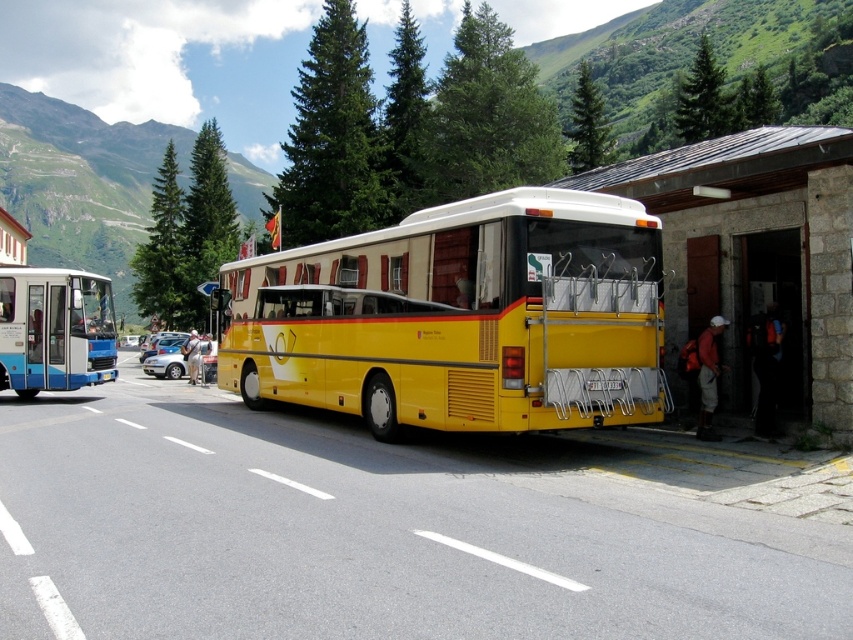
Between yellow matte bus at center and blue metallic bus at left, which one is positioned lower?

blue metallic bus at left is below.

Is yellow matte bus at center bigger than blue metallic bus at left?

Yes.

Measure the distance between point (x=656, y=349) and camera.

Point (x=656, y=349) and camera are 32.93 feet apart from each other.

This screenshot has width=853, height=640. What are the coordinates of `yellow matte bus at center` in the screenshot? It's located at (463, 317).

Which of these two, yellow matte bus at right or silver metallic car at center-left, stands taller?

yellow matte bus at right

Find the location of a particular element. This screenshot has width=853, height=640. yellow matte bus at right is located at coordinates (755, 256).

Who is more distant from viewer, (x=421, y=365) or (x=766, y=296)?

The point (x=766, y=296) is behind.

In the scene shown: Who is lower down, yellow matte bus at center or yellow matte bus at right?

Positioned lower is yellow matte bus at center.

Who is more distant from viewer, [283,273] or [850,428]?

Point [283,273]

This screenshot has height=640, width=853. In order to click on yellow matte bus at center in this screenshot , I will do `click(463, 317)`.